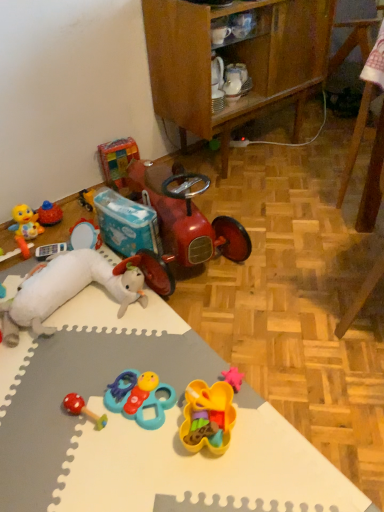
This screenshot has width=384, height=512. I want to click on free space in front of translucent plastic toy at center, which is the first toy in front-to-back order, so click(x=214, y=484).